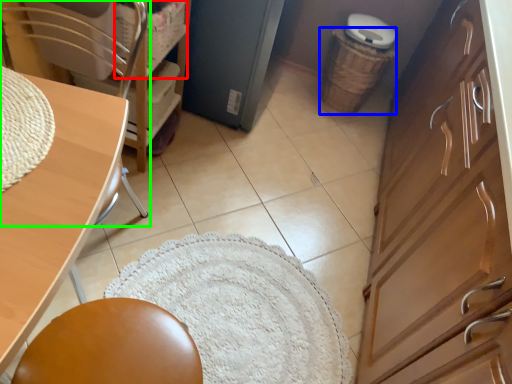
Question: Considering the real-world distances, which object is closest to basket (highlighted by a red box)? basket (highlighted by a blue box) or chair (highlighted by a green box).

Choices:
 (A) basket
 (B) chair

Answer: (B)